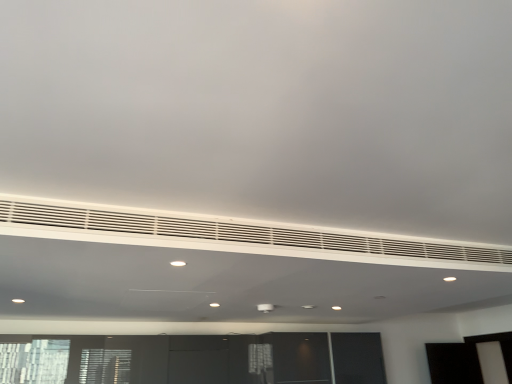
Question: Considering the relative sizes of white matte vent at center and white matte air conditioning at center in the image provided, is white matte vent at center shorter than white matte air conditioning at center?

Choices:
 (A) no
 (B) yes

Answer: (B)

Question: Can you confirm if white matte vent at center is smaller than white matte air conditioning at center?

Choices:
 (A) no
 (B) yes

Answer: (A)

Question: From the image's perspective, is white matte vent at center beneath white matte air conditioning at center?

Choices:
 (A) yes
 (B) no

Answer: (A)

Question: Considering the relative positions of white matte vent at center and white matte air conditioning at center in the image provided, is white matte vent at center to the left of white matte air conditioning at center from the viewer's perspective?

Choices:
 (A) yes
 (B) no

Answer: (A)

Question: Is white matte vent at center touching white matte air conditioning at center?

Choices:
 (A) yes
 (B) no

Answer: (B)

Question: Is white matte vent at center turned away from white matte air conditioning at center?

Choices:
 (A) yes
 (B) no

Answer: (B)

Question: From a real-world perspective, does white matte air conditioning at center sit lower than white matte vent at center?

Choices:
 (A) no
 (B) yes

Answer: (A)

Question: From a real-world perspective, is white matte air conditioning at center positioned over white matte vent at center based on gravity?

Choices:
 (A) no
 (B) yes

Answer: (B)

Question: Considering the relative positions of white matte air conditioning at center and white matte vent at center in the image provided, is white matte air conditioning at center behind white matte vent at center?

Choices:
 (A) yes
 (B) no

Answer: (A)

Question: Is white matte air conditioning at center wider than white matte vent at center?

Choices:
 (A) no
 (B) yes

Answer: (A)

Question: From the image's perspective, is white matte air conditioning at center on top of white matte vent at center?

Choices:
 (A) yes
 (B) no

Answer: (A)

Question: Does white matte air conditioning at center have a larger size compared to white matte vent at center?

Choices:
 (A) no
 (B) yes

Answer: (A)

Question: In the image, is white matte air conditioning at center positioned in front of or behind white matte vent at center?

Choices:
 (A) behind
 (B) front

Answer: (A)